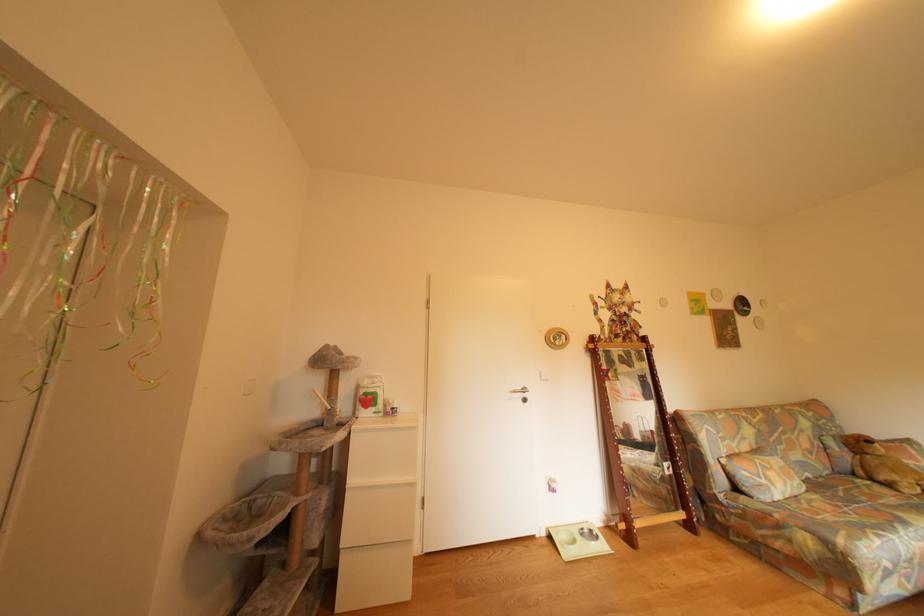
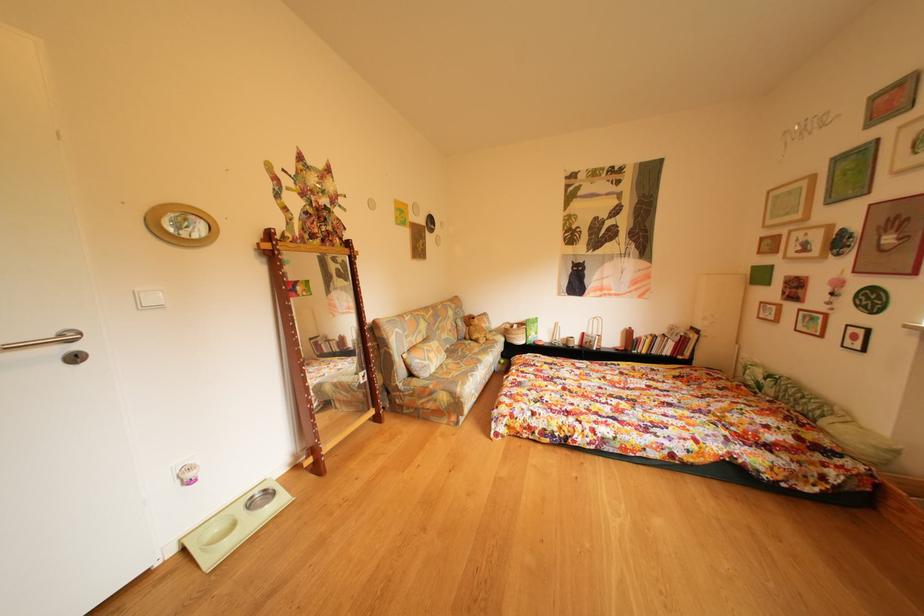
Question: The camera is either moving clockwise (left) or counter-clockwise (right) around the object. The first image is from the beginning of the video and the second image is from the end. Is the camera moving left or right when shooting the video?

Choices:
 (A) Left
 (B) Right

Answer: (A)